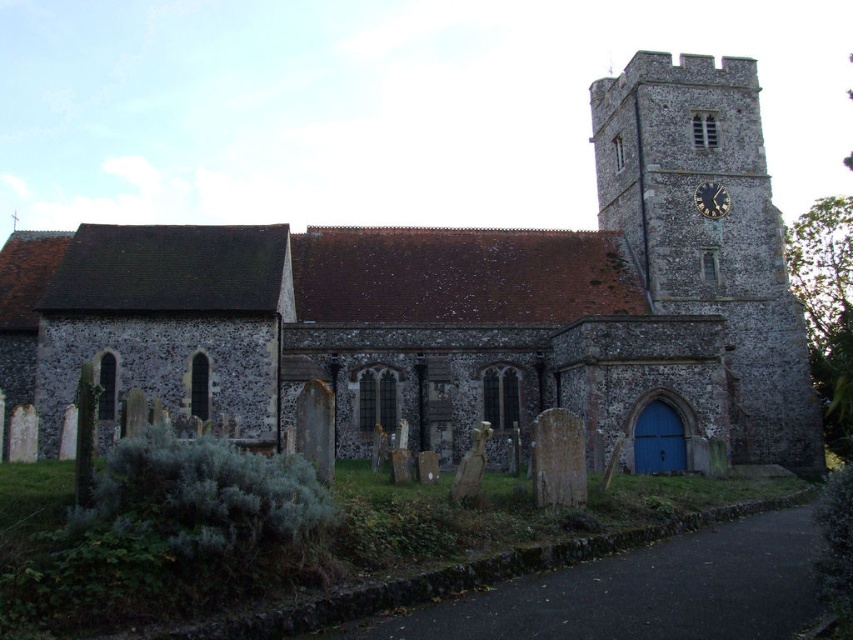
Question: Is stone church at center to the right of gold metallic clock at upper right from the viewer's perspective?

Choices:
 (A) yes
 (B) no

Answer: (B)

Question: Which point appears farthest from the camera in this image?

Choices:
 (A) (724, 244)
 (B) (426, 292)

Answer: (A)

Question: Can you confirm if stone clock tower at upper right is thinner than gold metallic clock at upper right?

Choices:
 (A) no
 (B) yes

Answer: (A)

Question: Based on their relative distances, which object is farther from the gold metallic clock at upper right?

Choices:
 (A) stone church at center
 (B) stone clock tower at upper right

Answer: (A)

Question: Which of the following is the farthest from the observer?

Choices:
 (A) stone church at center
 (B) stone clock tower at upper right

Answer: (B)

Question: Is stone clock tower at upper right smaller than gold metallic clock at upper right?

Choices:
 (A) no
 (B) yes

Answer: (A)